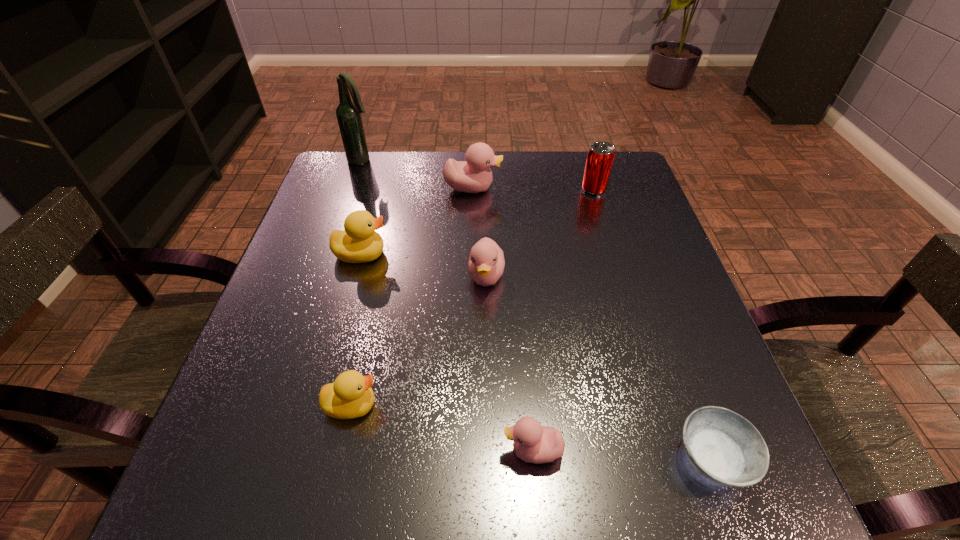
Locate an element on the screen. This screenshot has height=540, width=960. duckling identified as the fourth closest to the red soda can is located at coordinates (533, 443).

Locate which duckling ranks in proximity to the nearest duckling. Please provide its 2D coordinates. Your answer should be formatted as a tuple, i.e. [(x, y)], where the tuple contains the x and y coordinates of a point satisfying the conditions above.

[(350, 396)]

Select which pink duckling appears as the closest to the farthest duckling. Please provide its 2D coordinates. Your answer should be formatted as a tuple, i.e. [(x, y)], where the tuple contains the x and y coordinates of a point satisfying the conditions above.

[(486, 263)]

Where is `pink duckling that is the closest to the second biggest pink duckling`? The height and width of the screenshot is (540, 960). pink duckling that is the closest to the second biggest pink duckling is located at coordinates (474, 175).

Locate an element on the screen. The width and height of the screenshot is (960, 540). vacant position in the image that satisfies the following two spatial constraints: 1. on the face of the nearer yellow duckling; 2. on the left side of the shortest object is located at coordinates (340, 458).

You are a GUI agent. You are given a task and a screenshot of the screen. Output one action in this format:
    pyautogui.click(x=<x>, y=<y>)
    Task: Click on the vacant area in the image that satisfies the following two spatial constraints: 1. on the front-facing side of the second farthest pink duckling; 2. on the face of the second nearest duckling
    Image resolution: width=960 pixels, height=540 pixels.
    Given the screenshot: What is the action you would take?
    pyautogui.click(x=488, y=405)

Image resolution: width=960 pixels, height=540 pixels. Identify the location of vacant space that satisfies the following two spatial constraints: 1. on the front-facing side of the farthest pink duckling; 2. on the right side of the shortest object. (468, 458).